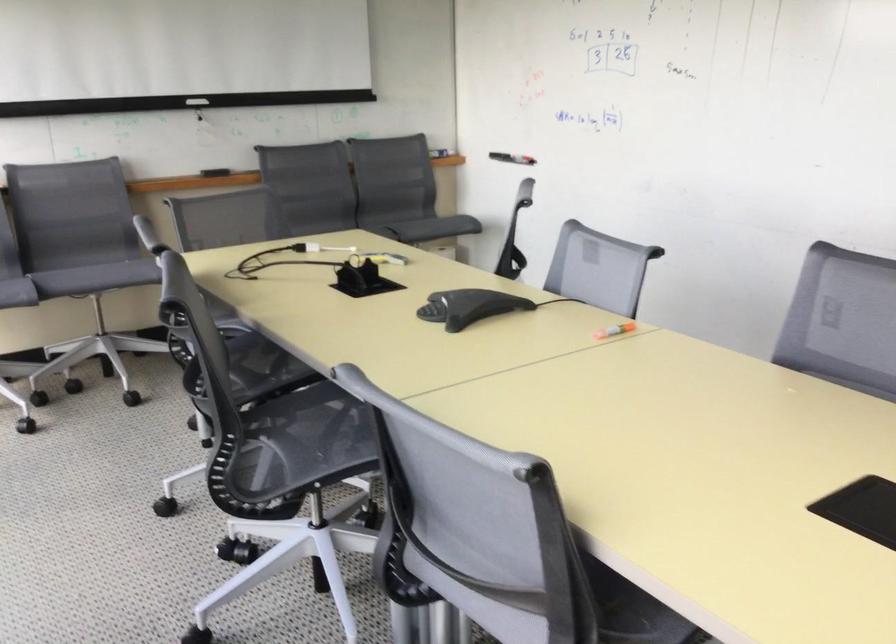
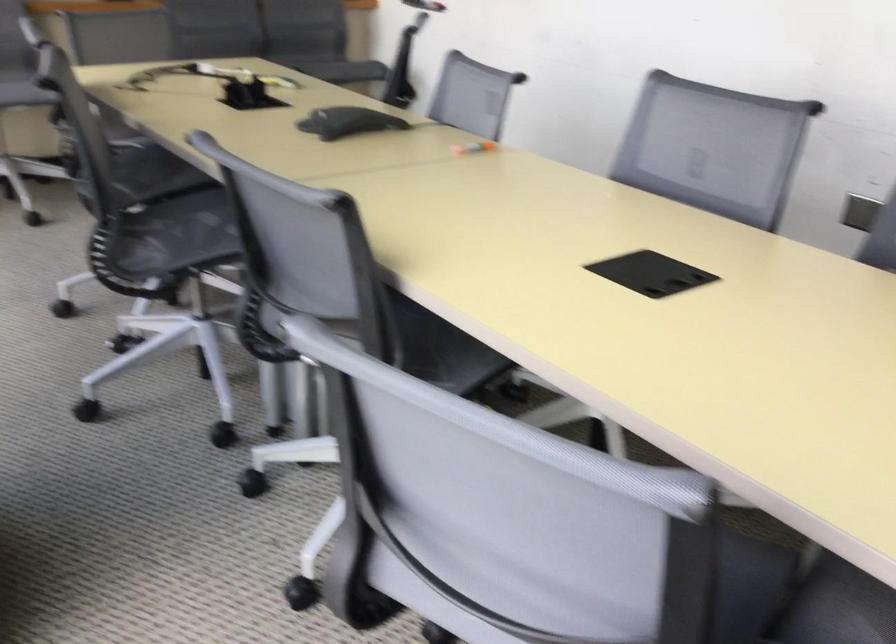
Where in the second image is the point corresponding to the point at 295,442 from the first image?

(176, 234)